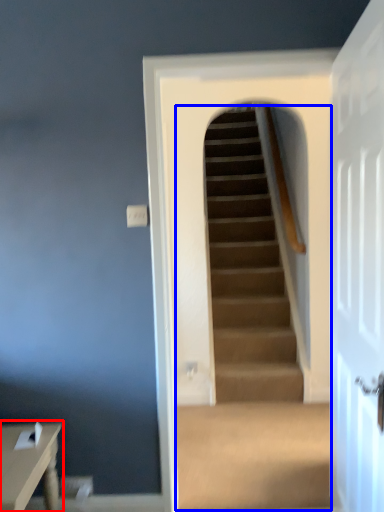
Question: Which object appears farthest to the camera in this image, table (highlighted by a red box) or escalator (highlighted by a blue box)?

Choices:
 (A) table
 (B) escalator

Answer: (B)